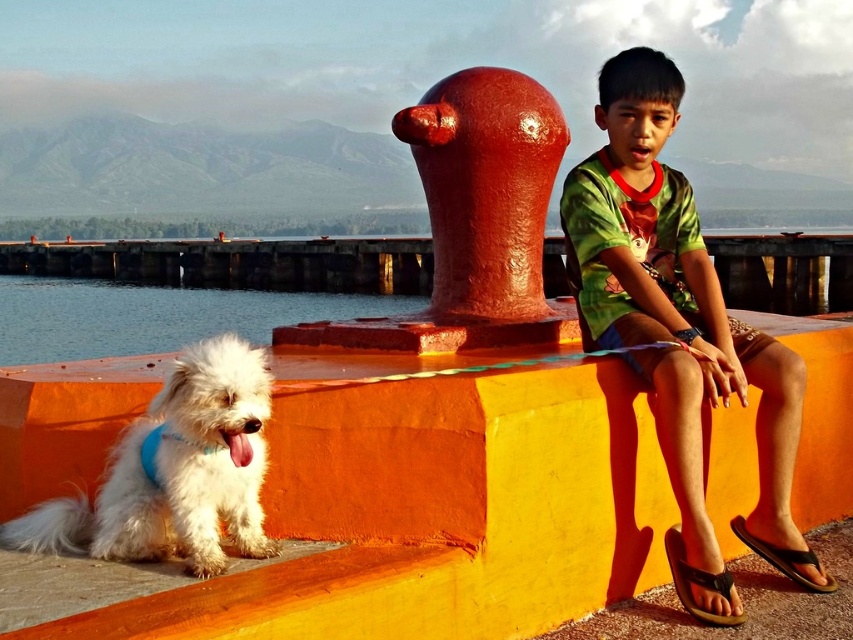
Question: Observing the image, what is the correct spatial positioning of orange matte ledge at lower center in reference to white fluffy dog at lower left?

Choices:
 (A) right
 (B) left

Answer: (A)

Question: Among these points, which one is farthest from the camera?

Choices:
 (A) (254, 301)
 (B) (90, 525)
 (C) (827, 577)

Answer: (A)

Question: Is white fluffy dog at lower left closer to the viewer compared to clear water at lower left?

Choices:
 (A) no
 (B) yes

Answer: (B)

Question: Estimate the real-world distances between objects in this image. Which object is farther from the white fluffy dog at lower left?

Choices:
 (A) orange matte ledge at lower center
 (B) clear water at lower left

Answer: (B)

Question: Which point is closer to the camera?

Choices:
 (A) (230, 484)
 (B) (616, 541)
 (C) (48, 298)

Answer: (A)

Question: In this image, where is orange matte ledge at lower center located relative to white fluffy dog at lower left?

Choices:
 (A) right
 (B) left

Answer: (A)